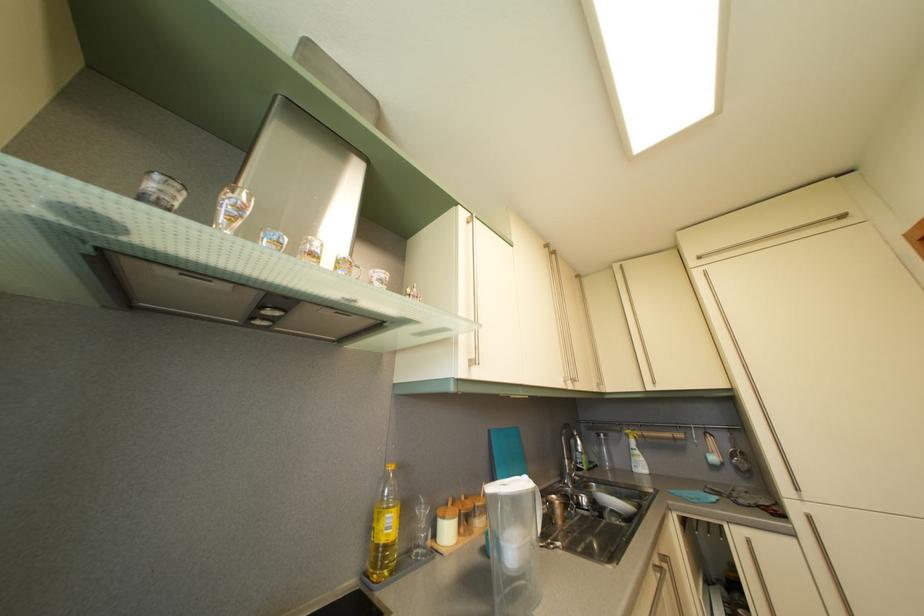
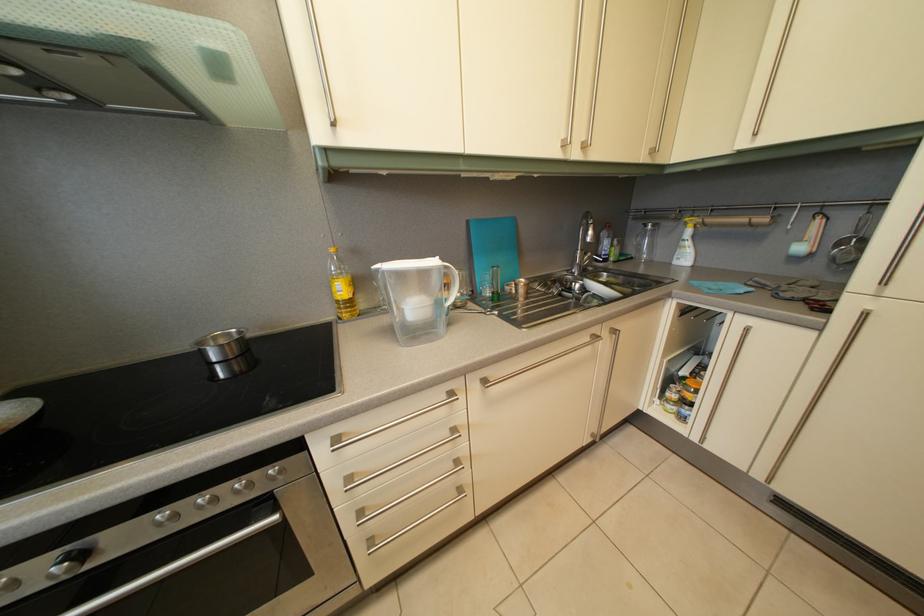
The point at (636, 443) is marked in the first image. Where is the corresponding point in the second image?

(694, 232)